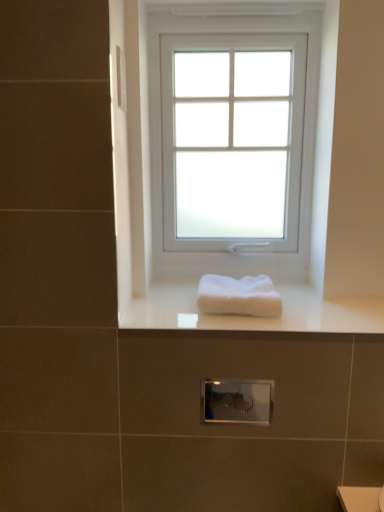
In order to click on free location in front of white fluffy towel at center in this screenshot , I will do tap(240, 325).